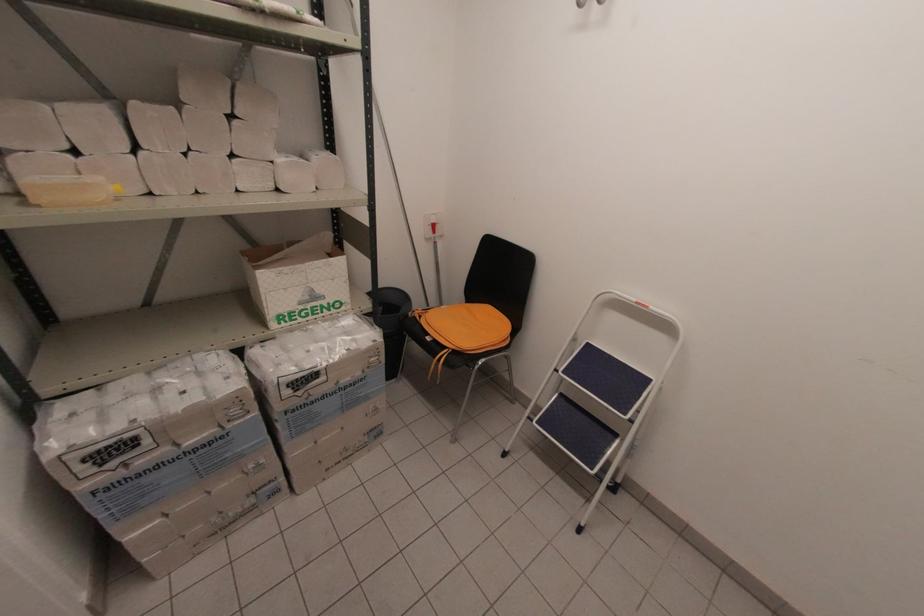
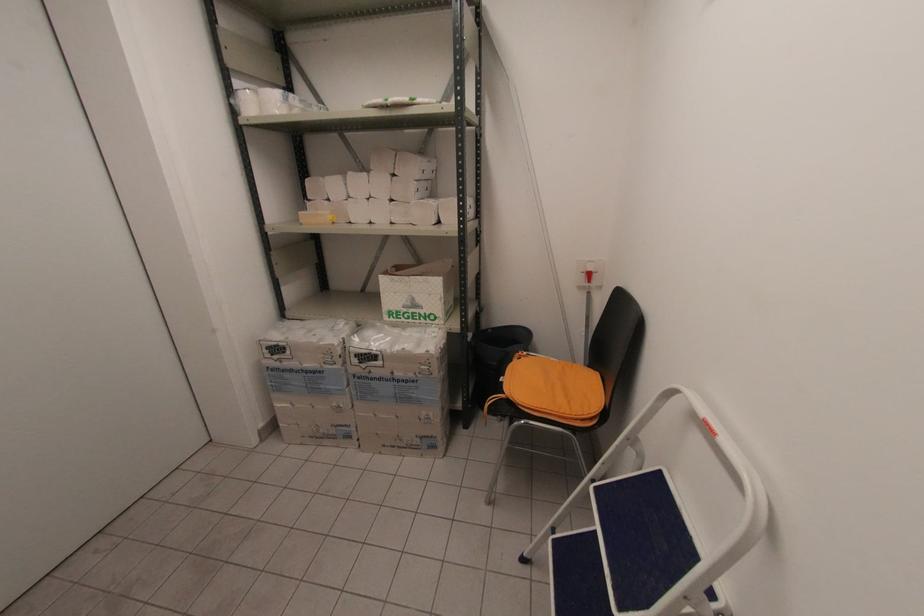
Question: The images are taken continuously from a first-person perspective. In which direction is your viewpoint rotating?

Choices:
 (A) Left
 (B) Right
 (C) Up
 (D) Down

Answer: (A)